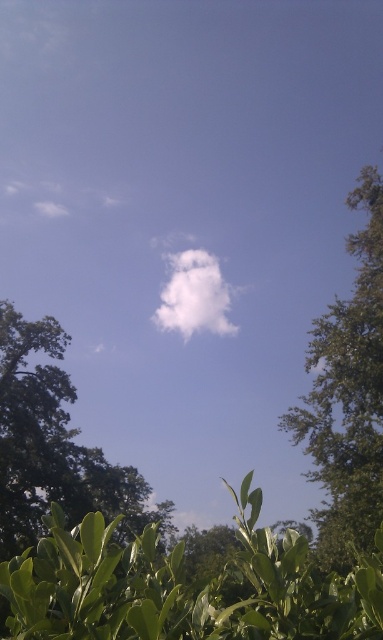
You are standing in the serene outdoor scene with the clear blue sky and fluffy white cloud. You notice a point marked at coordinates (54, 445). What object is located at this point?

The point at coordinates (54, 445) indicates a green leafy tree at lower left.

You are standing in the serene outdoor scene and want to take a photo of both the green leafy tree at right and the green leafy tree at lower left. Which tree should you focus on first to ensure both are in the frame without moving the camera?

The green leafy tree at right is positioned over the green leafy tree at lower left, so you should focus on the green leafy tree at lower left first to ensure both are in the frame without moving the camera.

You are standing in the serene outdoor scene with a clear blue sky. You notice a point marked at coordinates (348, 396). What object is located at this point?

The point at coordinates (348, 396) marks the green leafy tree at right.